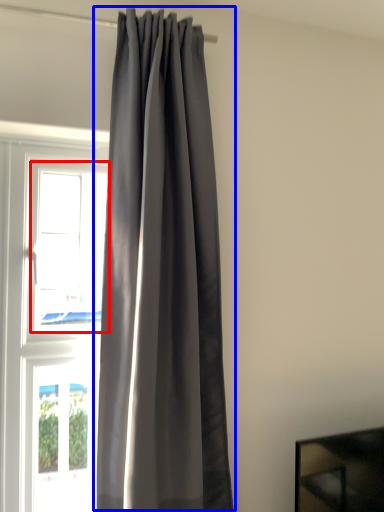
Question: Among these objects, which one is farthest to the camera, window (highlighted by a red box) or curtain (highlighted by a blue box)?

Choices:
 (A) window
 (B) curtain

Answer: (A)